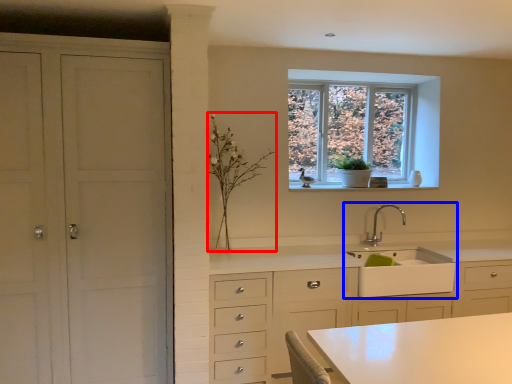
Question: Which of the following is the farthest to the observer, plant (highlighted by a red box) or sink (highlighted by a blue box)?

Choices:
 (A) plant
 (B) sink

Answer: (B)